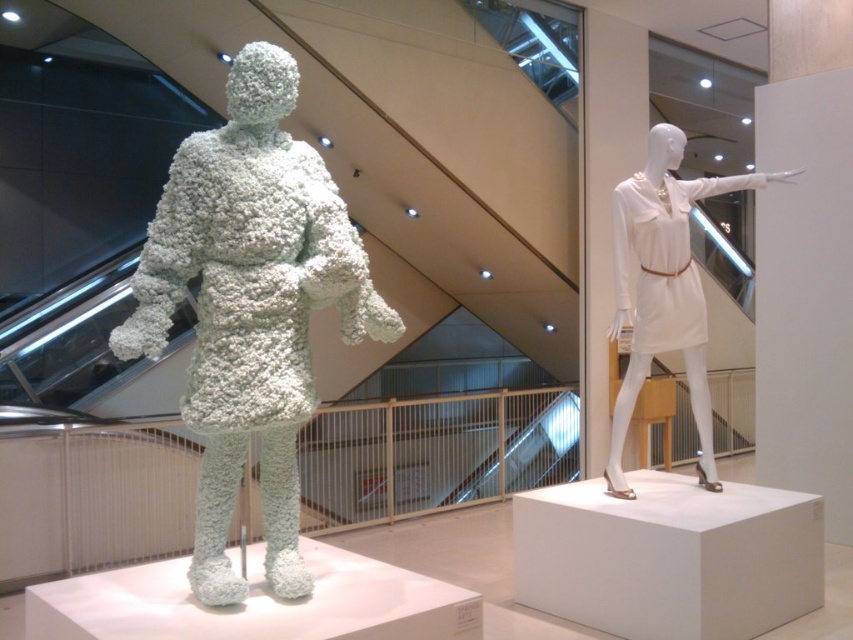
Question: Which object is closer to the camera taking this photo?

Choices:
 (A) white fluffy sculpture at left
 (B) white matte dress at right
 (C) metallic silver escalator at center

Answer: (A)

Question: Does white matte dress at right come behind metallic silver escalator at center?

Choices:
 (A) no
 (B) yes

Answer: (A)

Question: Does white fluffy sculpture at left have a greater width compared to white matte dress at right?

Choices:
 (A) no
 (B) yes

Answer: (A)

Question: Which point is farther from the camera taking this photo?

Choices:
 (A) (308, 289)
 (B) (677, 291)
 (C) (560, 448)

Answer: (C)

Question: Based on their relative distances, which object is nearer to the white matte dress at right?

Choices:
 (A) metallic silver escalator at center
 (B) white fluffy sculpture at left

Answer: (B)

Question: Does white fluffy sculpture at left have a larger size compared to metallic silver escalator at center?

Choices:
 (A) yes
 (B) no

Answer: (B)